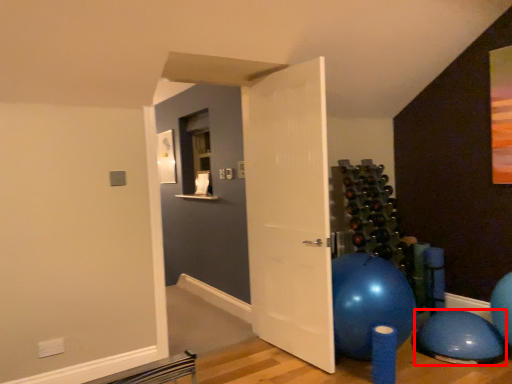
Question: From the image's perspective, considering the relative positions of balloon (annotated by the red box) and door in the image provided, where is balloon (annotated by the red box) located with respect to the staircase?

Choices:
 (A) below
 (B) above

Answer: (A)